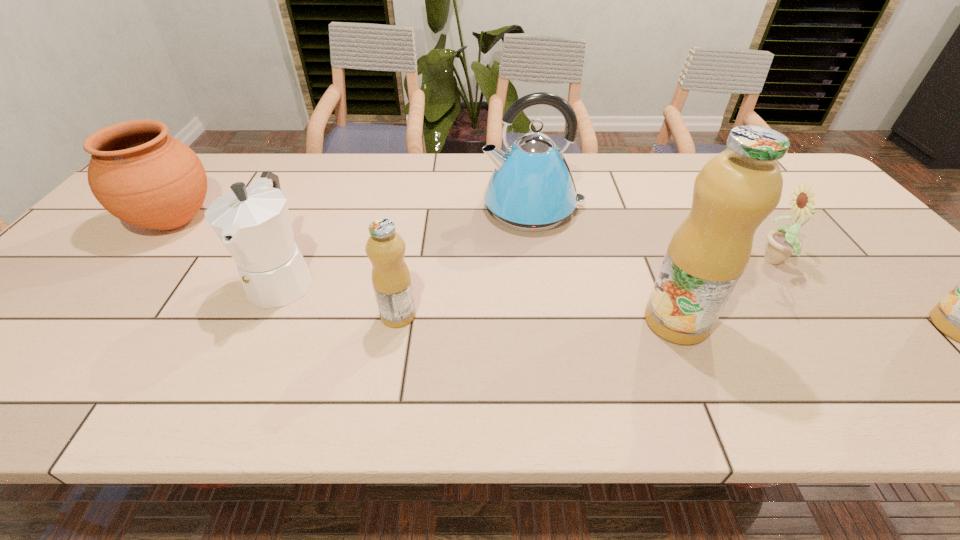
Identify the location of free space located at the spout of the kettle. The image size is (960, 540). (458, 208).

What are the coordinates of `free space located at the spout of the kettle` in the screenshot? It's located at (444, 208).

Image resolution: width=960 pixels, height=540 pixels. Find the location of `free space located at the spout of the kettle`. free space located at the spout of the kettle is located at coordinates (355, 208).

Find the location of a particular element. vacant region located on the front-facing side of the second object from right to left is located at coordinates (613, 262).

Identify the location of free space located on the front-facing side of the second object from right to left. The height and width of the screenshot is (540, 960). (720, 262).

Identify the location of vacant space situated on the front-facing side of the second object from right to left. The height and width of the screenshot is (540, 960). (606, 262).

You are a GUI agent. You are given a task and a screenshot of the screen. Output one action in this format:
    pyautogui.click(x=<x>, y=<y>)
    Task: Click on the vacant space located 0.160m on the right of the leftmost object
    This screenshot has height=540, width=960.
    Given the screenshot: What is the action you would take?
    pyautogui.click(x=276, y=221)

At what (x,y) coordinates should I click in order to perform the action: click on vacant space located at the spout of the coffeepot. Please return your answer as a coordinate pair (x, y). The image size is (960, 540). Looking at the image, I should click on (250, 352).

Image resolution: width=960 pixels, height=540 pixels. Identify the location of object positioned at the far edge. (532, 189).

Locate an element on the screen. object situated at the near edge is located at coordinates (736, 190).